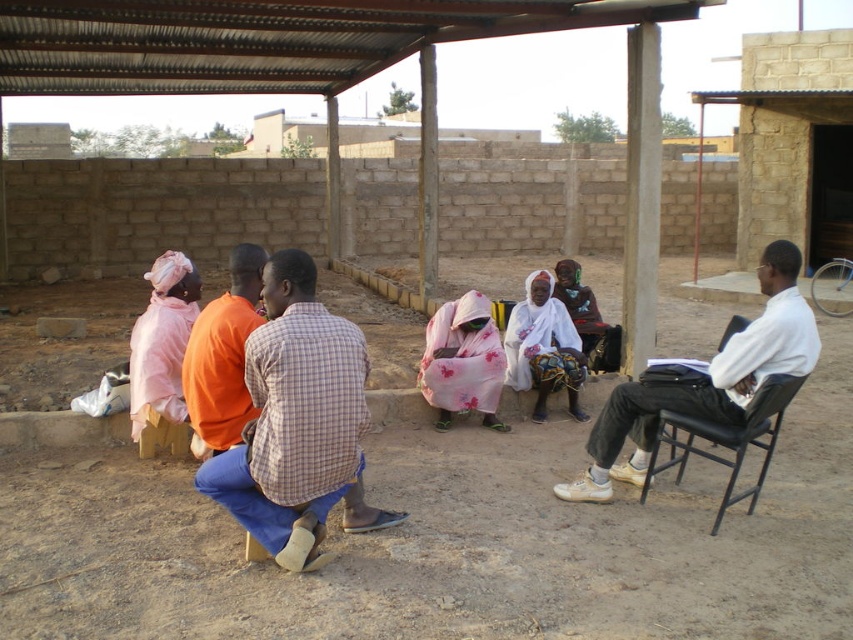
Question: Among these points, which one is nearest to the camera?

Choices:
 (A) (732, 460)
 (B) (471, 346)
 (C) (808, 317)
 (D) (305, 394)

Answer: (D)

Question: Among these points, which one is farthest from the camera?

Choices:
 (A) (155, 288)
 (B) (268, 288)
 (C) (675, 460)
 (D) (614, 412)

Answer: (A)

Question: Can you confirm if brown dirt field at center is positioned below pink floral fabric at center?

Choices:
 (A) no
 (B) yes

Answer: (B)

Question: Is checkered fabric shirt at center positioned at the back of black leather chair at right?

Choices:
 (A) yes
 (B) no

Answer: (B)

Question: Which point is farther from the camera taking this photo?

Choices:
 (A) (218, 396)
 (B) (167, 355)

Answer: (B)

Question: Does white smooth shirt at center appear on the left side of pink floral fabric at center?

Choices:
 (A) no
 (B) yes

Answer: (A)